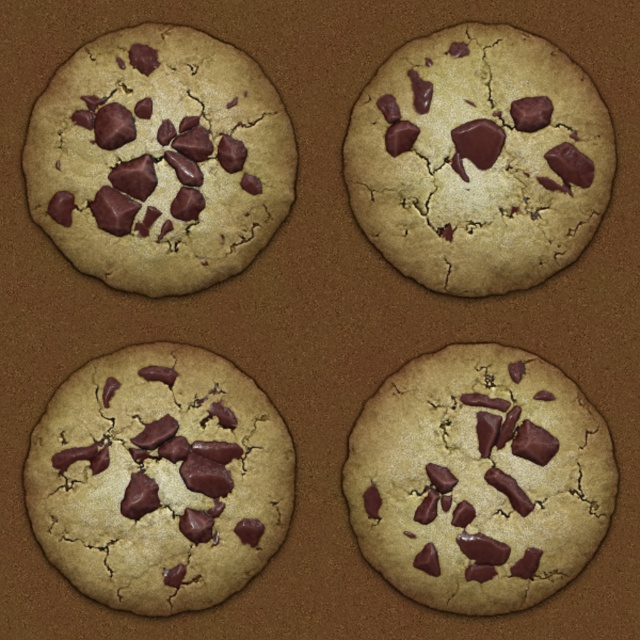
Can you confirm if matte chocolate chip cookie at upper right is shorter than matte brown cookie at bottom left?

In fact, matte chocolate chip cookie at upper right may be taller than matte brown cookie at bottom left.

What do you see at coordinates (477, 160) in the screenshot?
I see `matte chocolate chip cookie at upper right` at bounding box center [477, 160].

Is point (522, 74) positioned in front of point (264, 520)?

No, it is not.

The image size is (640, 640). What are the coordinates of `matte chocolate chip cookie at upper right` in the screenshot? It's located at pos(477,160).

Is matte chocolate chip cookie at upper right below matte chocolate chip cookie at upper left?

Incorrect, matte chocolate chip cookie at upper right is not positioned below matte chocolate chip cookie at upper left.

Can you confirm if matte chocolate chip cookie at upper right is shorter than matte chocolate chip cookie at upper left?

Indeed, matte chocolate chip cookie at upper right has a lesser height compared to matte chocolate chip cookie at upper left.

Between point (428, 40) and point (236, 74), which one is positioned behind?

Point (428, 40)

Identify the location of matte chocolate chip cookie at upper right. (477, 160).

Is point (356, 451) in front of point (68, 480)?

No, (356, 451) is behind (68, 480).

Can you confirm if matte brown cookie at bottom right is bigger than matte brown cookie at bottom left?

No.

Which is behind, point (502, 394) or point (253, 432)?

The point (253, 432) is behind.

At what (x,y) coordinates should I click in order to perform the action: click on matte brown cookie at bottom right. Please return your answer as a coordinate pair (x, y). Looking at the image, I should click on (477, 480).